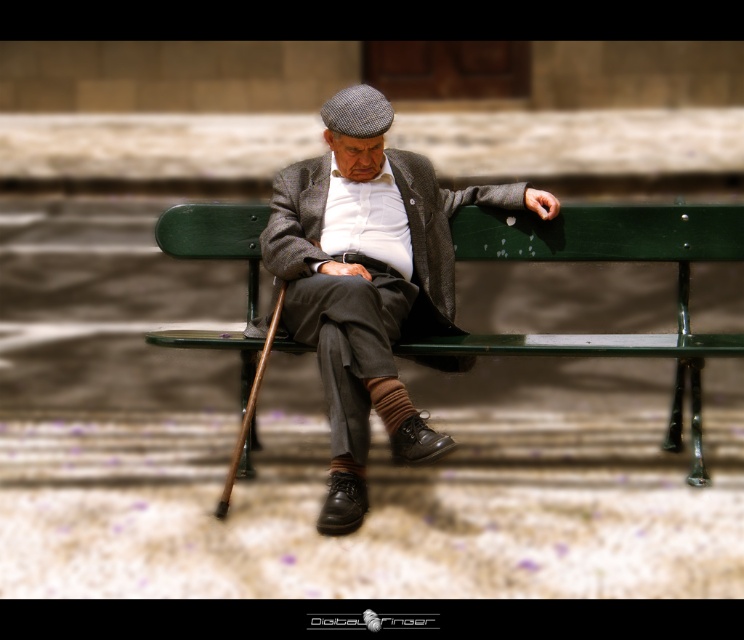
Is matte gray woolen coat at center positioned behind green painted wood park bench at center?

No.

Is matte gray woolen coat at center to the right of green painted wood park bench at center from the viewer's perspective?

Incorrect, matte gray woolen coat at center is not on the right side of green painted wood park bench at center.

Is point (356, 396) less distant than point (609, 336)?

Yes.

Locate an element on the screen. The image size is (744, 640). matte gray woolen coat at center is located at coordinates click(x=368, y=280).